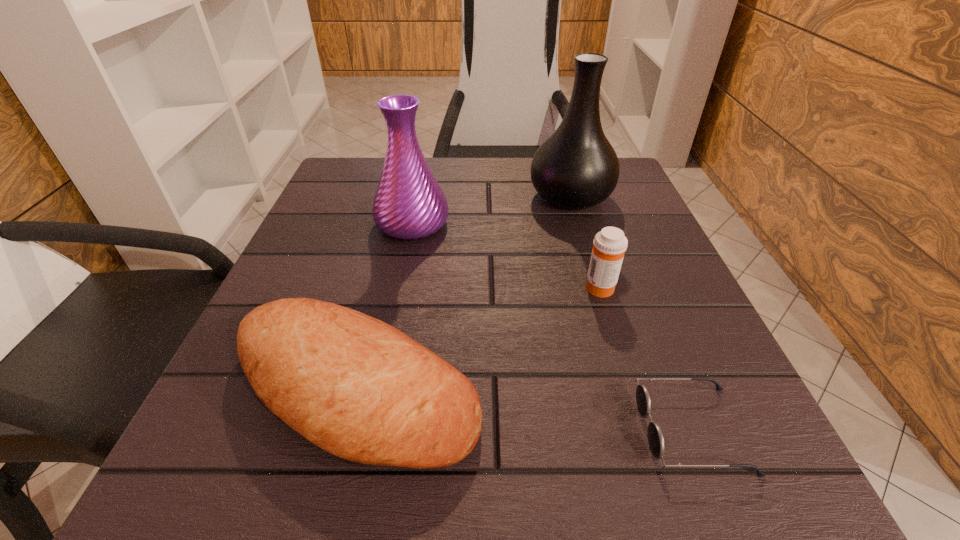
Locate an element on the screen. The image size is (960, 540). the right vase is located at coordinates (576, 167).

This screenshot has width=960, height=540. In order to click on the shorter vase in this screenshot , I will do `click(409, 204)`.

The width and height of the screenshot is (960, 540). In order to click on the fourth shortest object in this screenshot , I will do `click(409, 204)`.

Image resolution: width=960 pixels, height=540 pixels. In order to click on medicine in this screenshot , I will do `click(610, 244)`.

The width and height of the screenshot is (960, 540). I want to click on bread, so click(358, 388).

This screenshot has width=960, height=540. What are the coordinates of `the shortest object` in the screenshot? It's located at (655, 436).

The height and width of the screenshot is (540, 960). I want to click on vacant space located 0.310m on the left of the right vase, so click(x=386, y=197).

This screenshot has height=540, width=960. I want to click on vacant position located on the right of the left vase, so click(x=594, y=224).

Locate an element on the screen. free space located on the right of the third nearest object is located at coordinates (662, 287).

Where is `free spot located on the right of the bread`? Image resolution: width=960 pixels, height=540 pixels. free spot located on the right of the bread is located at coordinates (564, 390).